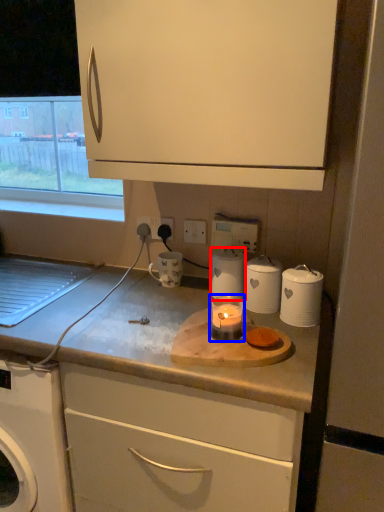
Question: Which point is closer to the camera, kitchen appliance (highlighted by a red box) or candle holder (highlighted by a blue box)?

Choices:
 (A) kitchen appliance
 (B) candle holder

Answer: (B)